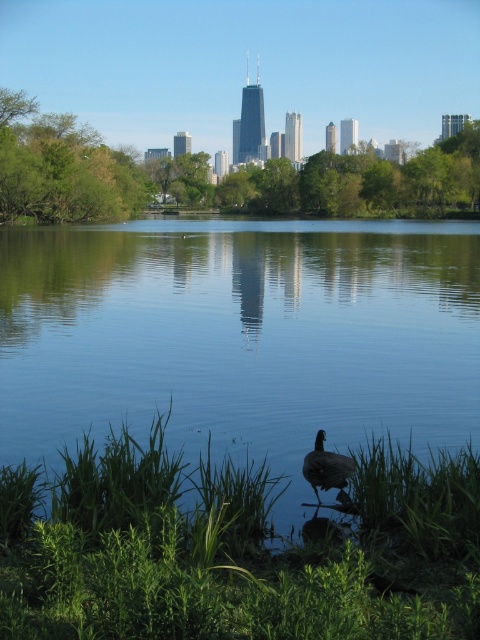
You are a photographer aiming to capture the brown feathered duck at lower center in the foreground. Since the green leafy grass at lower center is blocking part of the duck, can you adjust your camera angle to ensure the duck is fully visible?

The green leafy grass at lower center is taller than the brown feathered duck at lower center, so adjusting the camera angle downward might help to see under the grass and fully capture the duck.

You are a photographer aiming to capture the brown feathered duck at lower center and the blue smooth water at center in your shot. Which object will appear closer to the camera in the photo?

The blue smooth water at center will appear closer to the camera because the brown feathered duck at lower center is behind it.

In the scene shown: You are a photographer aiming to capture the reflection of the city skyline in the blue smooth water at center. However, the brown feathered duck at lower center is blocking the view. Can you adjust your position to avoid the duck while still capturing the reflection?

The blue smooth water at center is taller than the brown feathered duck at lower center. By positioning yourself higher, such as standing or using a raised camera angle, you can look down over the duck and still capture the reflection in the blue smooth water at center.